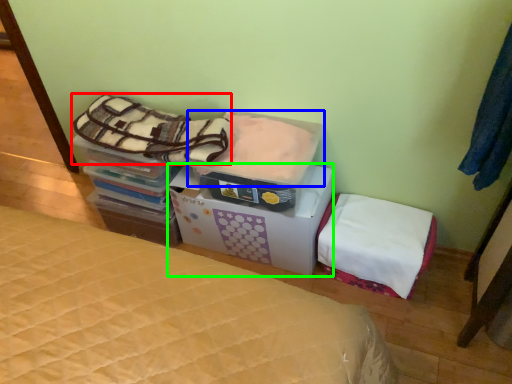
Question: Which object is the farthest from blanket (highlighted by a red box)? Choose among these: blanket (highlighted by a blue box) or cardboard box (highlighted by a green box).

Choices:
 (A) blanket
 (B) cardboard box

Answer: (B)